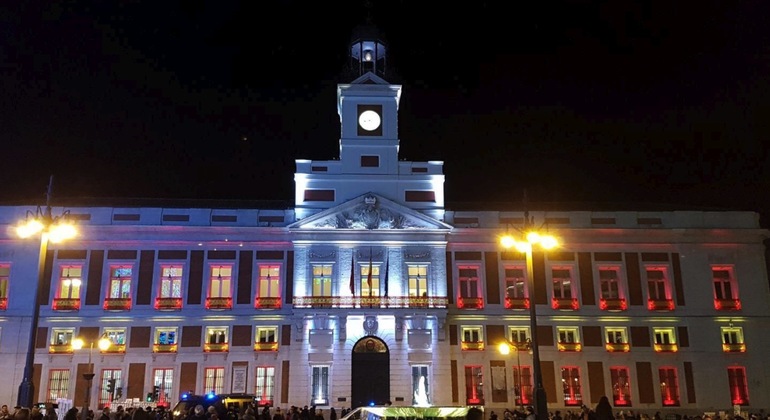
Where is `lights`? lights is located at coordinates (551, 244), (534, 237), (517, 246), (491, 236), (68, 224), (58, 232), (31, 223), (21, 231).